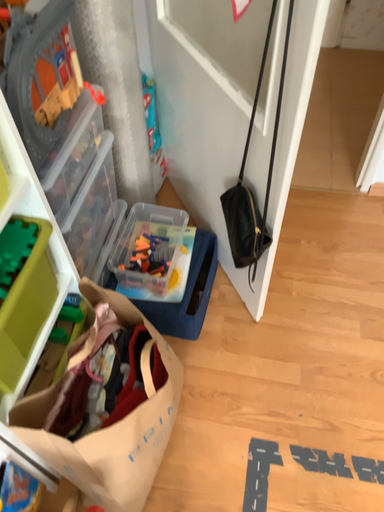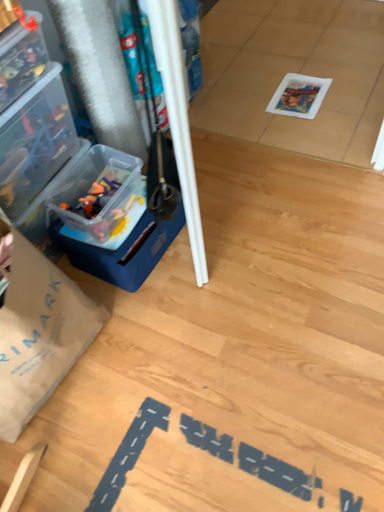
Question: How did the camera likely rotate when shooting the video?

Choices:
 (A) rotated left
 (B) rotated right

Answer: (A)